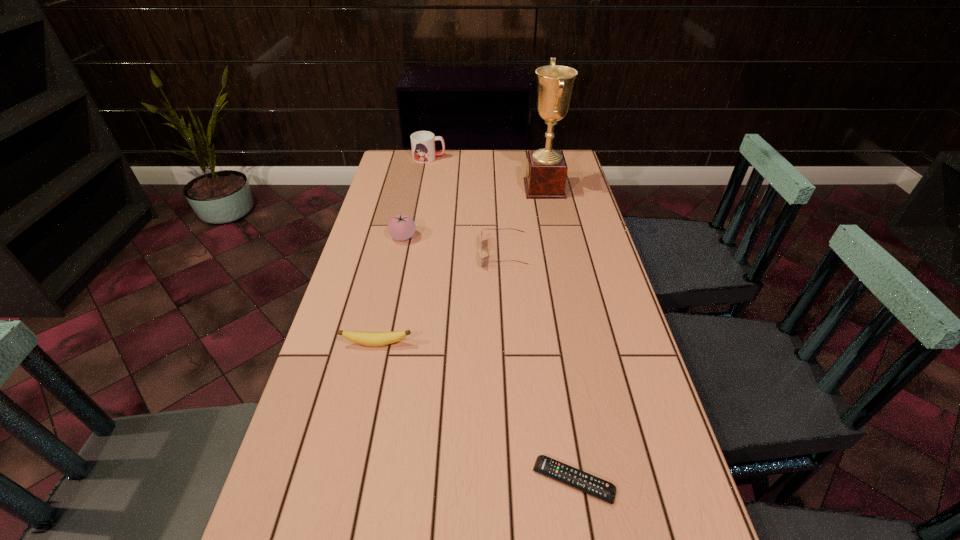
Where is `the tallest object`? The image size is (960, 540). the tallest object is located at coordinates (546, 173).

Locate an element on the screen. Image resolution: width=960 pixels, height=540 pixels. trophy cup is located at coordinates (546, 173).

The height and width of the screenshot is (540, 960). Find the location of `the second tallest object`. the second tallest object is located at coordinates (422, 142).

Locate an element on the screen. mug is located at coordinates (422, 142).

Locate an element on the screen. Image resolution: width=960 pixels, height=540 pixels. tomato is located at coordinates (400, 227).

Where is `banana`? Image resolution: width=960 pixels, height=540 pixels. banana is located at coordinates (365, 338).

Identify the location of sunglasses. This screenshot has width=960, height=540. (482, 229).

Locate an element on the screen. The width and height of the screenshot is (960, 540). remote control is located at coordinates (568, 475).

Where is `the nearest object`? The width and height of the screenshot is (960, 540). the nearest object is located at coordinates (568, 475).

You are a GUI agent. You are given a task and a screenshot of the screen. Output one action in this format:
    pyautogui.click(x=<x>, y=<y>)
    Task: Click on the vacant area situated on the plaque of the tallest object
    
    Given the screenshot: What is the action you would take?
    pos(445,188)